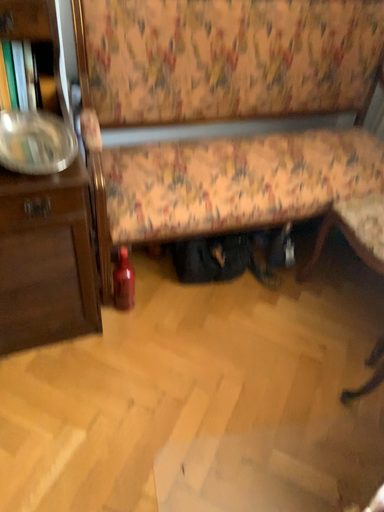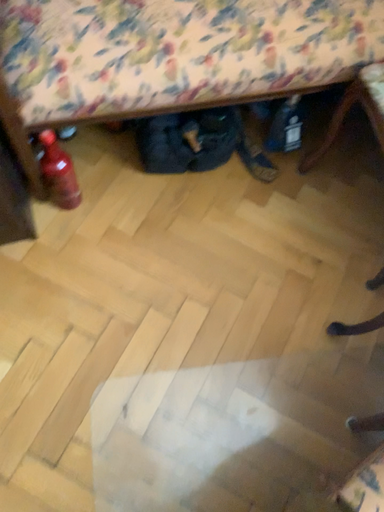
Question: How did the camera likely rotate when shooting the video?

Choices:
 (A) rotated downward
 (B) rotated upward

Answer: (A)